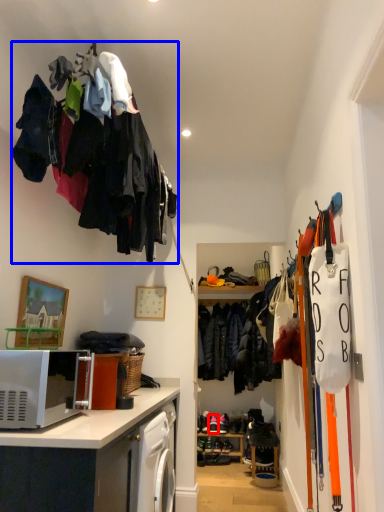
Question: Which object is further to the camera taking this photo, footwear (highlighted by a red box) or clothing (highlighted by a blue box)?

Choices:
 (A) footwear
 (B) clothing

Answer: (A)